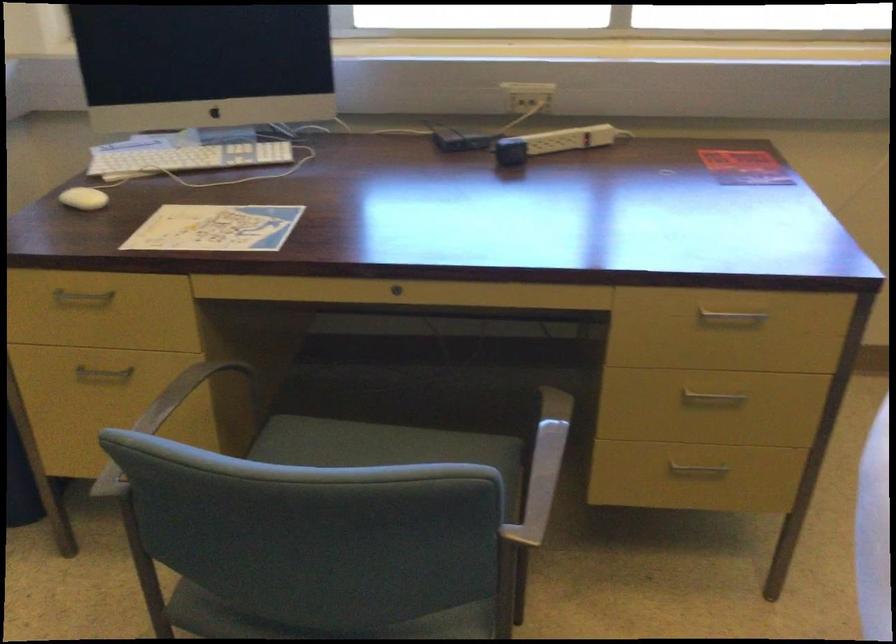
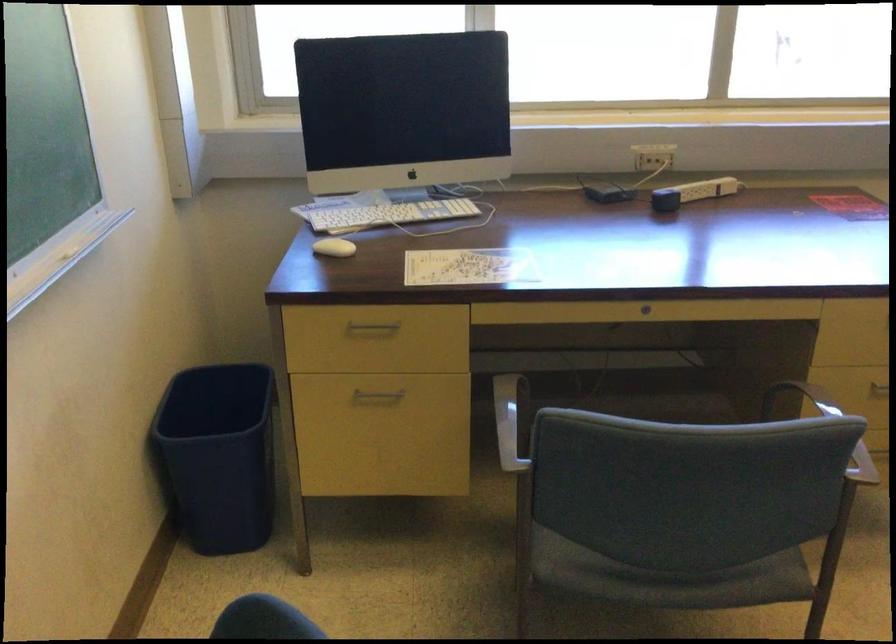
Where in the second image is the point corresponding to (x=442, y=487) from the first image?

(825, 427)